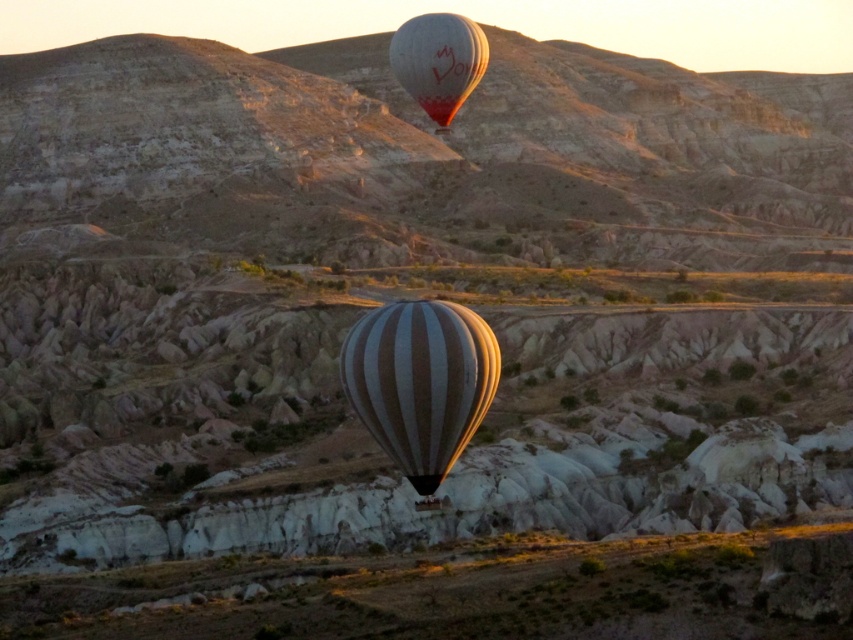
Question: Among these points, which one is farthest from the camera?

Choices:
 (A) [412, 52]
 (B) [384, 355]

Answer: (A)

Question: Which point is farther to the camera?

Choices:
 (A) white striped balloon at upper center
 (B) striped fabric balloon at center

Answer: (A)

Question: Is striped fabric balloon at center to the left of white striped balloon at upper center from the viewer's perspective?

Choices:
 (A) yes
 (B) no

Answer: (A)

Question: Does striped fabric balloon at center have a smaller size compared to white striped balloon at upper center?

Choices:
 (A) no
 (B) yes

Answer: (A)

Question: Which object is closer to the camera taking this photo?

Choices:
 (A) striped fabric balloon at center
 (B) white striped balloon at upper center

Answer: (A)

Question: Is striped fabric balloon at center positioned in front of white striped balloon at upper center?

Choices:
 (A) no
 (B) yes

Answer: (B)